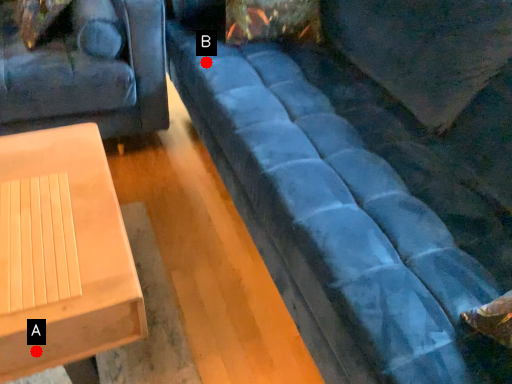
Question: Two points are circled on the image, labeled by A and B beside each circle. Which point is closer to the camera?

Choices:
 (A) A is closer
 (B) B is closer

Answer: (A)